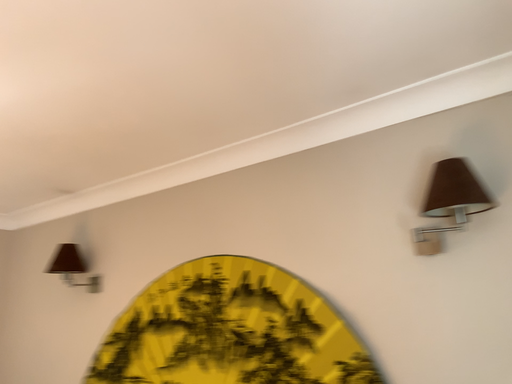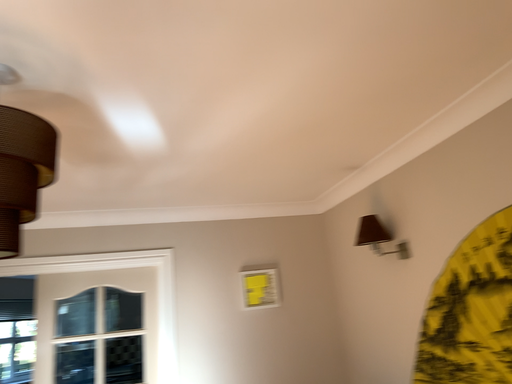
Question: Which way did the camera rotate in the video?

Choices:
 (A) rotated right
 (B) rotated left

Answer: (B)